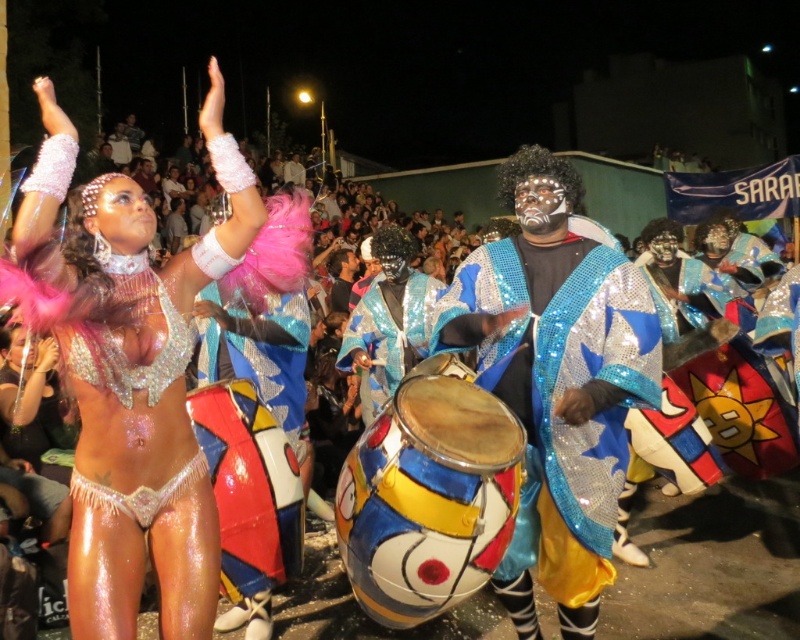
Between point (370, 433) and point (232, 444), which one is positioned in front?

Point (370, 433)

Who is lower down, painted wood drum at center or painted fabric drum at center?

Positioned lower is painted fabric drum at center.

Where is `painted wood drum at center`? painted wood drum at center is located at coordinates (428, 499).

Does sparkly silver bikini at upper left appear on the left side of painted wood drum at center?

Yes, sparkly silver bikini at upper left is to the left of painted wood drum at center.

Between point (142, 502) and point (396, 509), which one is positioned behind?

The point (396, 509) is behind.

Where is `sparkly silver bikini at upper left`? This screenshot has width=800, height=640. sparkly silver bikini at upper left is located at coordinates (132, 376).

Does point (640, 376) come closer to viewer compared to point (224, 538)?

Yes, point (640, 376) is closer to viewer.

Identify the location of shiny sequined robe at center. The height and width of the screenshot is (640, 800). (560, 392).